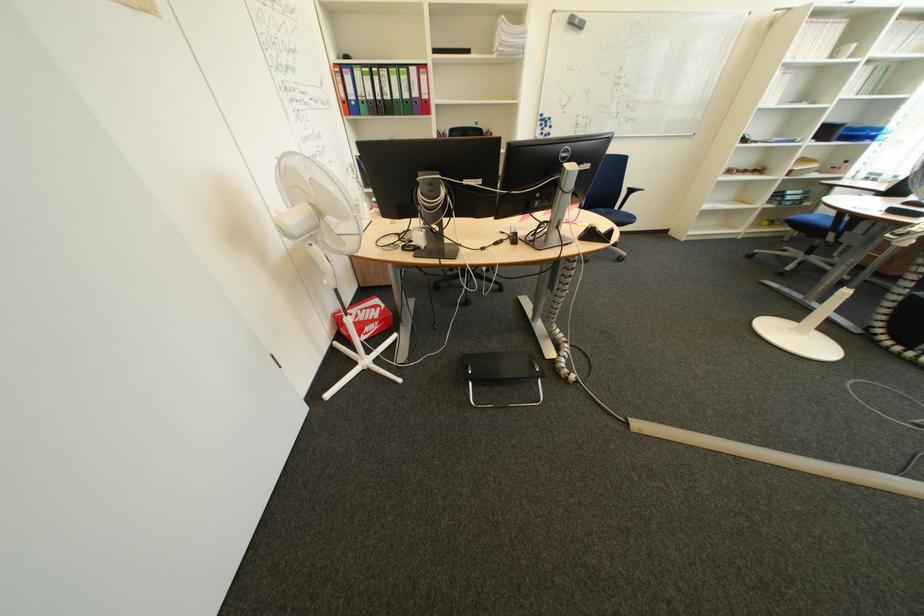
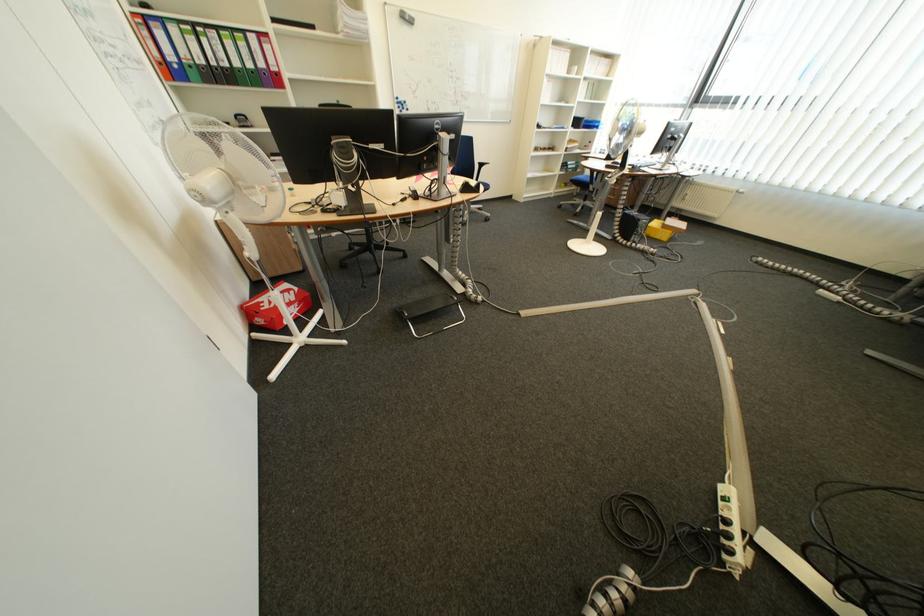
The point at (483, 373) is marked in the first image. Where is the corresponding point in the second image?

(419, 315)